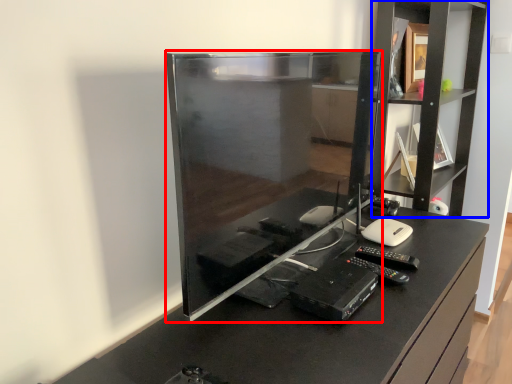
Question: Among these objects, which one is nearest to the camera, desktop computer (highlighted by a red box) or shelf (highlighted by a blue box)?

Choices:
 (A) desktop computer
 (B) shelf

Answer: (A)